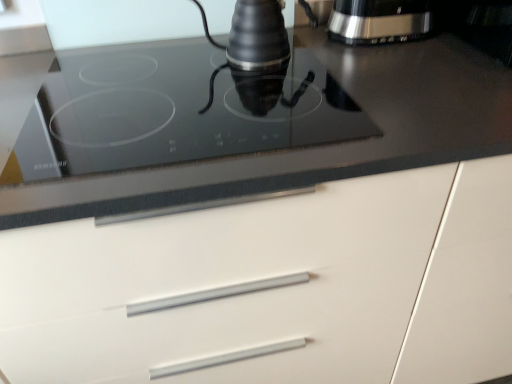
Where is `vacant space in front of satin silver coffee maker at upper right`? The width and height of the screenshot is (512, 384). vacant space in front of satin silver coffee maker at upper right is located at coordinates (408, 64).